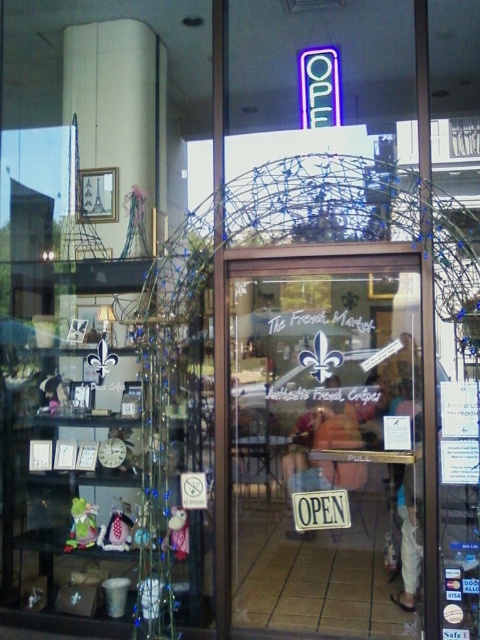
Looking at this image, you are a customer approaching the entrance of The French Market. You see the transparent glass door at center and the matte plastic bag at center. Which object is bigger in size?

The transparent glass door at center is larger in size than the matte plastic bag at center.

From the picture: You are a delivery person holding a matte plastic bag at center and need to hand it to the customer waiting at the transparent glass door at center. Can you reach the customer without moving your feet?

The transparent glass door at center and matte plastic bag at center are 9.35 inches apart from each other. Since the distance is less than an arm length, you can reach the customer without moving your feet.

You are a customer entering The French Market and see the transparent glass door at center and the matte plastic bag at center. Which object is closer to your right side when facing the entrance?

The transparent glass door at center is positioned on the right side of the matte plastic bag at center, so when facing the entrance, the transparent glass door at center would be closer to your right side.